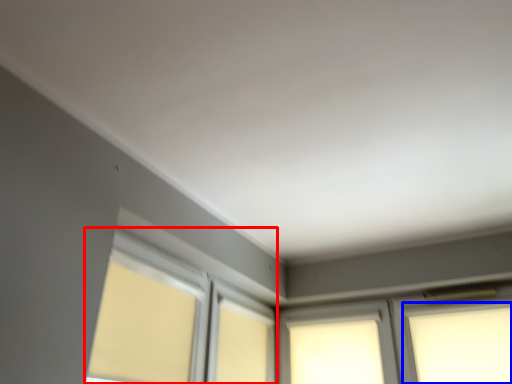
Question: Among these objects, which one is farthest to the camera, bay window (highlighted by a red box) or window (highlighted by a blue box)?

Choices:
 (A) bay window
 (B) window

Answer: (B)